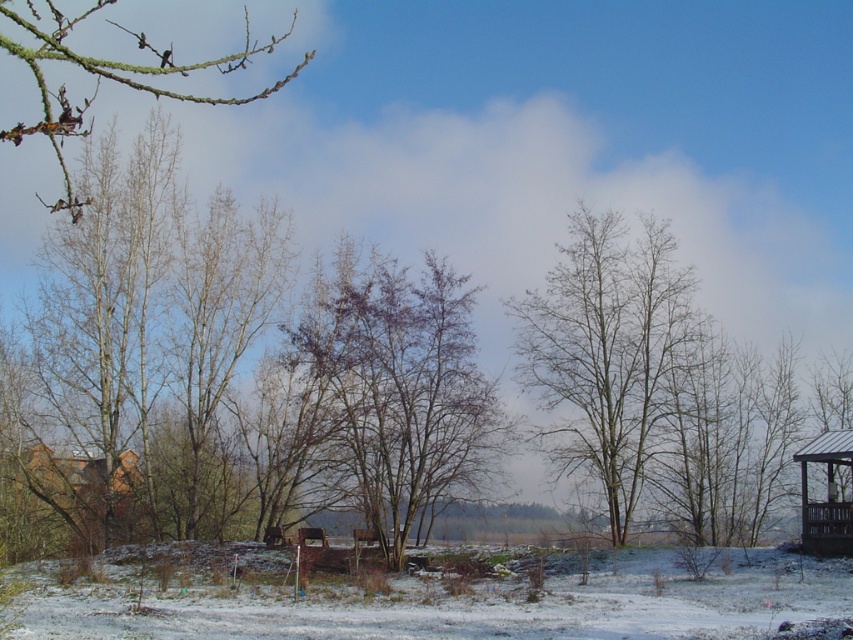
Consider the image. You are standing in the winter landscape and want to take a photo of the brown wooden gazebo at right. However, the bare branches at center are blocking your view. Can you determine if the branches are taller than the gazebo?

The bare branches at center has a greater height compared to brown wooden gazebo at right, so the branches are blocking the view because they are taller than the gazebo.

You are standing in the winter landscape scene and want to determine which of the two points, point (x=7, y=464) or point (x=837, y=502), is closer to you. Based on the image, which point is nearer?

Point (x=7, y=464) is closer to you because it is further to the viewer than point (x=837, y=502).

You are planning to host a small gathering and need to choose between the brown wooden hut at lower left and the brown wooden gazebo at right for more space. Which one should you choose?

The brown wooden hut at lower left is bigger than the brown wooden gazebo at right, so you should choose the brown wooden hut at lower left for more space.